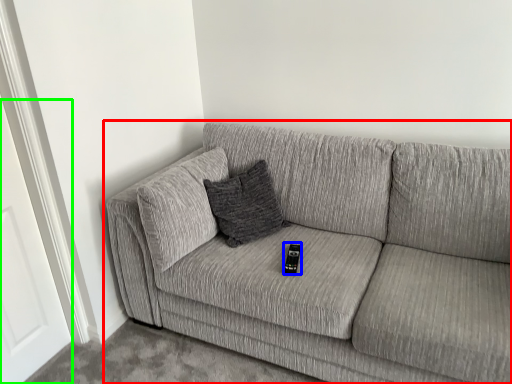
Question: Which is farther away from studio couch (highlighted by a red box)? remote (highlighted by a blue box) or door (highlighted by a green box)?

Choices:
 (A) remote
 (B) door

Answer: (B)